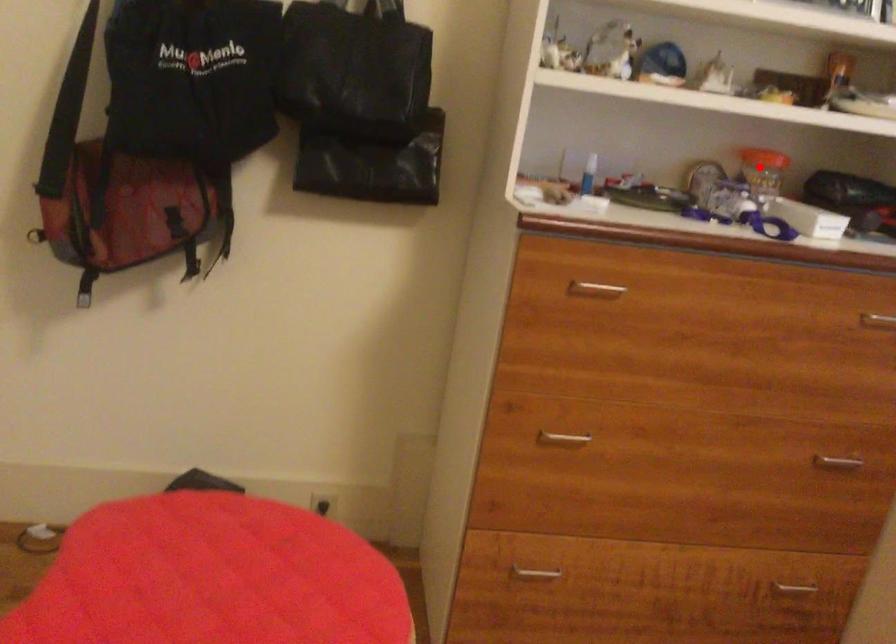
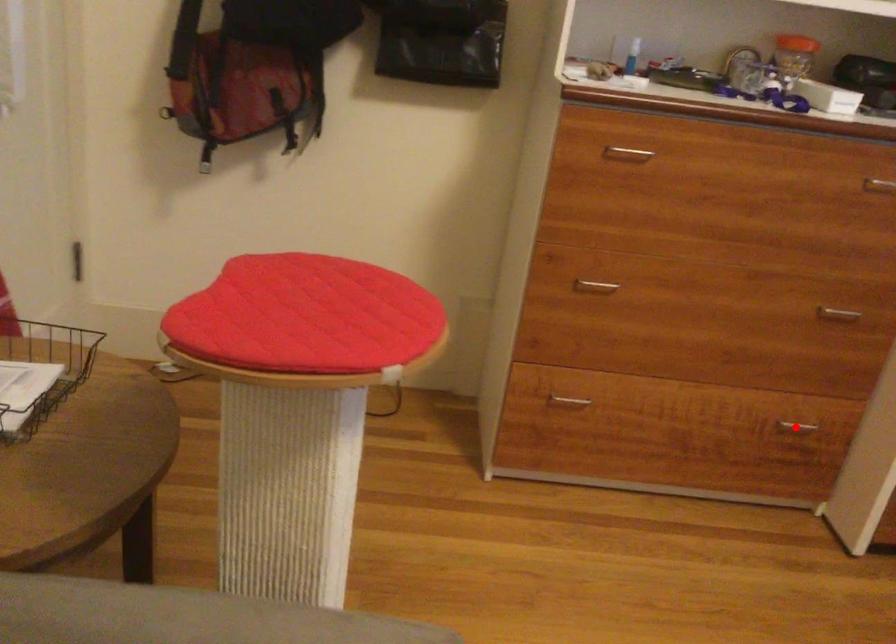
I am providing you with two images of the same scene from different viewpoints. A red point is marked on the first image and another point is marked on the second image. Is the red point in image1 aligned with the point shown in image2?

No